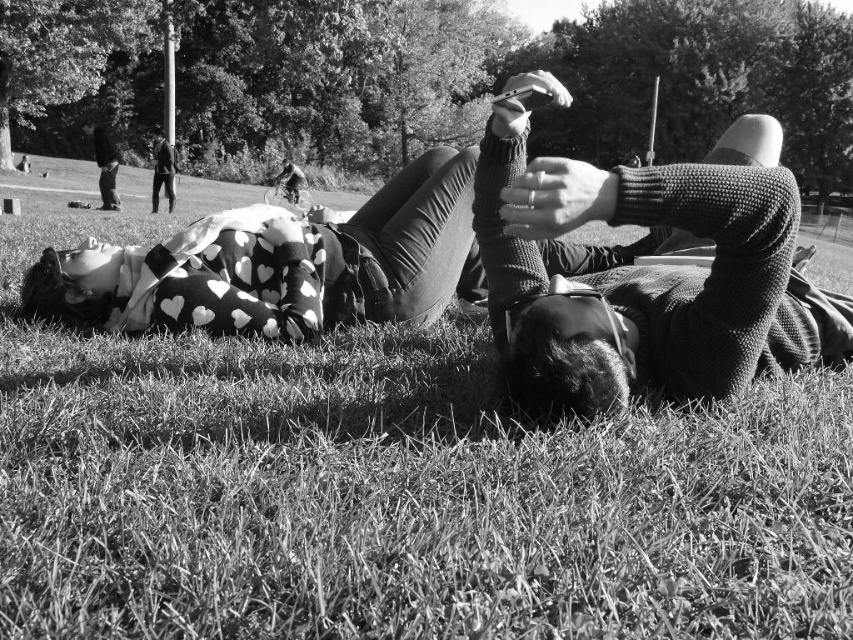
You are a photographer trying to capture a candid shot of both the knitted sweater at center and the dark gray suit at upper left. Based on their positions, which one would you need to focus on first if you want to ensure both are in the frame?

The knitted sweater at center is taller than the dark gray suit at upper left, so you should focus on the knitted sweater at center first to ensure both are in the frame.

You are a photographer taking a picture of the knitted sweater at center and the dark gray suit at upper left. Which object should you focus on first to ensure both are in sharp focus?

You should focus on the knitted sweater at center first because it is closer to the viewer than the dark gray suit at upper left, so starting with the closer object will help achieve sharp focus for both.